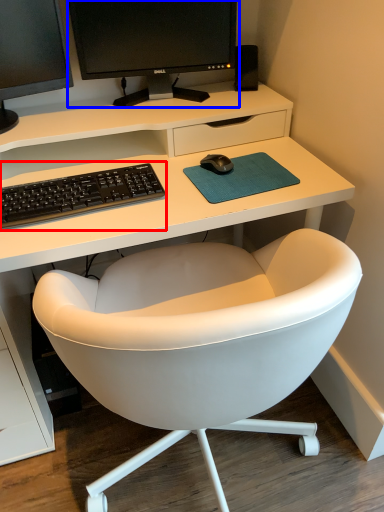
Question: Which object appears closest to the camera in this image, computer keyboard (highlighted by a red box) or computer monitor (highlighted by a blue box)?

Choices:
 (A) computer keyboard
 (B) computer monitor

Answer: (A)